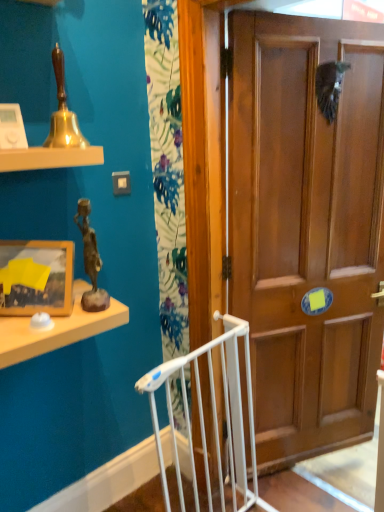
Question: Is wooden door at center positioned in front of bronze statue at upper left?

Choices:
 (A) yes
 (B) no

Answer: (B)

Question: From a real-world perspective, is wooden door at center located beneath bronze statue at upper left?

Choices:
 (A) no
 (B) yes

Answer: (B)

Question: Considering the relative sizes of wooden door at center and bronze statue at upper left in the image provided, is wooden door at center shorter than bronze statue at upper left?

Choices:
 (A) no
 (B) yes

Answer: (A)

Question: From the image's perspective, is wooden door at center located above bronze statue at upper left?

Choices:
 (A) no
 (B) yes

Answer: (A)

Question: Does wooden door at center have a greater height compared to bronze statue at upper left?

Choices:
 (A) yes
 (B) no

Answer: (A)

Question: Considering the relative sizes of wooden door at center and bronze statue at upper left in the image provided, is wooden door at center thinner than bronze statue at upper left?

Choices:
 (A) no
 (B) yes

Answer: (B)

Question: Can wooden door at center be found inside bronze statue at upper left?

Choices:
 (A) no
 (B) yes

Answer: (A)

Question: Considering the relative positions of bronze statue at upper left and wooden door at center in the image provided, is bronze statue at upper left to the left of wooden door at center from the viewer's perspective?

Choices:
 (A) yes
 (B) no

Answer: (A)

Question: Can you confirm if bronze statue at upper left is taller than wooden door at center?

Choices:
 (A) yes
 (B) no

Answer: (B)

Question: Is bronze statue at upper left oriented away from wooden door at center?

Choices:
 (A) yes
 (B) no

Answer: (B)

Question: From the image's perspective, is bronze statue at upper left under wooden door at center?

Choices:
 (A) no
 (B) yes

Answer: (A)

Question: Can you confirm if bronze statue at upper left is shorter than wooden door at center?

Choices:
 (A) yes
 (B) no

Answer: (A)

Question: Is wooden framed picture at left next to bronze statue at upper left?

Choices:
 (A) no
 (B) yes

Answer: (A)